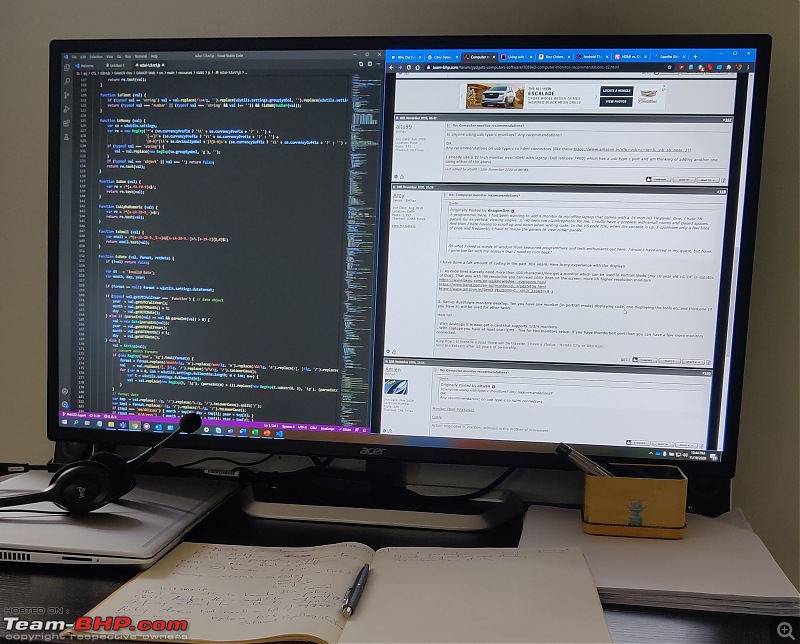
You are a GUI agent. You are given a task and a screenshot of the screen. Output one action in this format:
    pyautogui.click(x=<x>, y=<y>)
    Task: Click on the wall
    Image resolution: width=800 pixels, height=644 pixels.
    Given the screenshot: What is the action you would take?
    pyautogui.click(x=762, y=337), pyautogui.click(x=14, y=247), pyautogui.click(x=430, y=19)